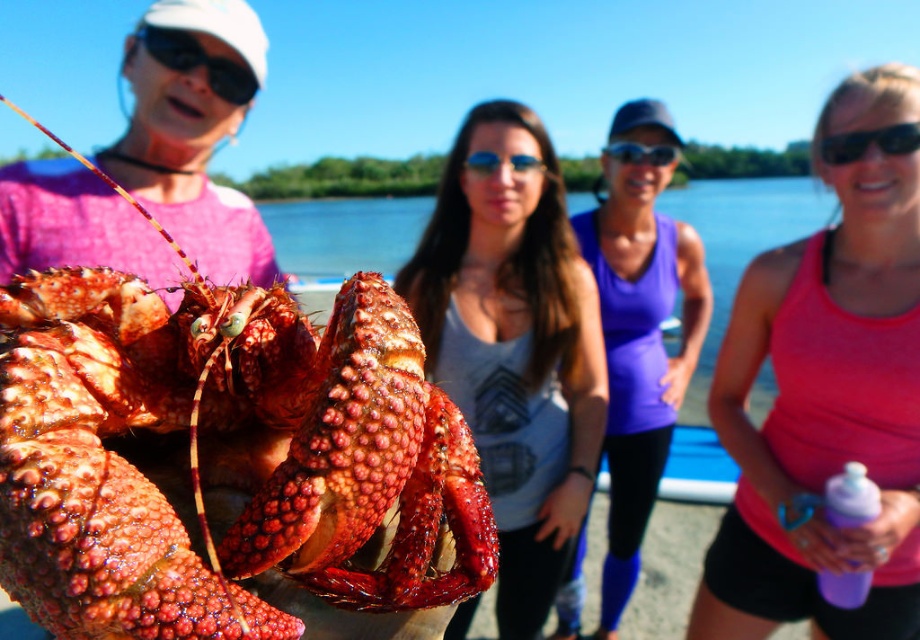
You are organizing a picnic and have a purple plastic bottle at lower right and blue reflective glasses at center. Which item can hold more liquid?

The purple plastic bottle at lower right has a larger size compared to blue reflective glasses at center, so it can hold more liquid.

You are a photographer trying to capture a photo of the black plastic goggles at upper left and the purple fabric tank top at center. Which object should you focus on first if you want to ensure both are in focus without adjusting your camera settings?

The black plastic goggles at upper left should be focused on first because the purple fabric tank top at center is located below it, meaning the goggles are closer to the camera. By focusing on the closer object, the tank top will also be within the depth of field.

You are a photographer trying to capture a clear shot of both the purple plastic bottle at lower right and the blue reflective glasses at center. Based on their positions, which object should you focus on first to ensure both are in frame?

The purple plastic bottle at lower right is located below the blue reflective glasses at center. To ensure both are in frame, focus on the blue reflective glasses at center first as it is higher up, allowing the camera to capture the lower positioned purple plastic bottle at lower right naturally within the shot.